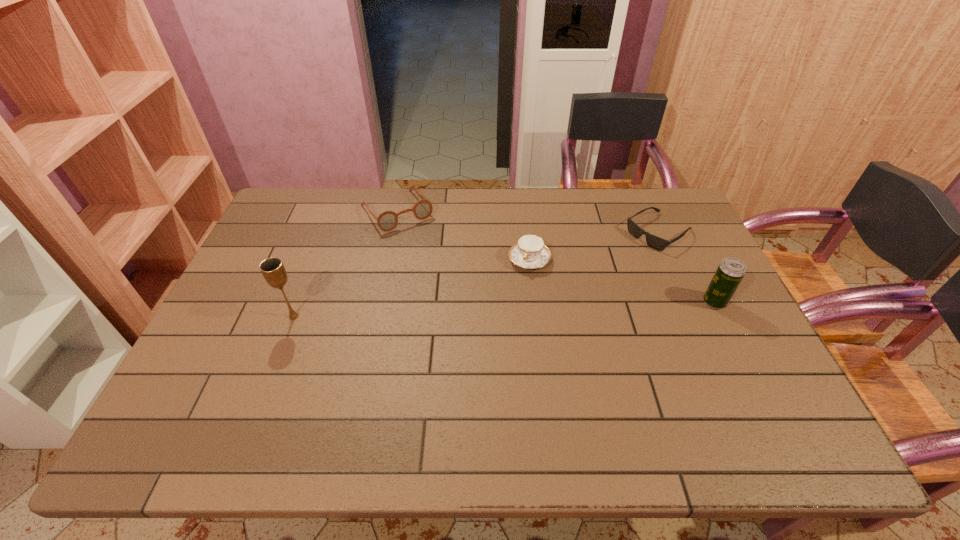
You are a GUI agent. You are given a task and a screenshot of the screen. Output one action in this format:
    pyautogui.click(x=<x>, y=<y>)
    Task: Click on the vacant area between the second tallest object and the tallest object
    This screenshot has height=540, width=960.
    Given the screenshot: What is the action you would take?
    pyautogui.click(x=504, y=309)

Identify the location of vacant space in between the fourth shortest object and the teacup. (622, 281).

Where is `vacant area between the leftmost object and the spectacles`? The width and height of the screenshot is (960, 540). vacant area between the leftmost object and the spectacles is located at coordinates (346, 264).

In order to click on free space that is in between the teacup and the beer can in this screenshot , I will do `click(622, 281)`.

This screenshot has height=540, width=960. What are the coordinates of `vacant space that is in between the sunglasses and the beer can` in the screenshot? It's located at (686, 267).

Find the location of `empty space that is in between the second tallest object and the spectacles`. empty space that is in between the second tallest object and the spectacles is located at coordinates (556, 256).

The width and height of the screenshot is (960, 540). Find the location of `vacant space that is in between the tallest object and the spectacles`. vacant space that is in between the tallest object and the spectacles is located at coordinates [x=346, y=264].

Locate an element on the screen. This screenshot has height=540, width=960. unoccupied position between the teacup and the sunglasses is located at coordinates (594, 246).

Point out which object is positioned as the fourth nearest to the sunglasses. Please provide its 2D coordinates. Your answer should be formatted as a tuple, i.e. [(x, y)], where the tuple contains the x and y coordinates of a point satisfying the conditions above.

[(273, 270)]

This screenshot has width=960, height=540. Identify the location of the closest object to the third object from right to left. (388, 220).